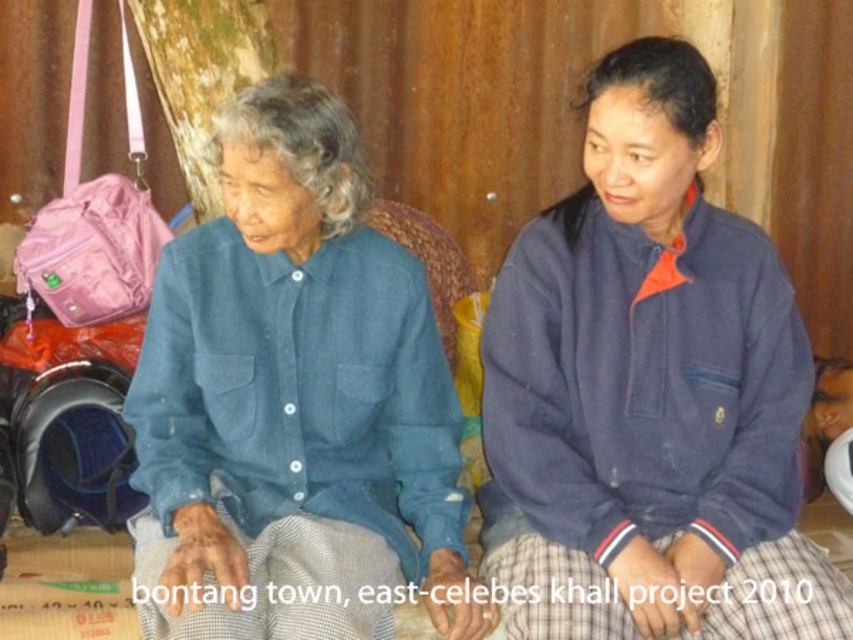
Between navy blue fleece at center and blue denim shirt at center, which one appears on the right side from the viewer's perspective?

navy blue fleece at center is more to the right.

Find the location of a particular element. The width and height of the screenshot is (853, 640). navy blue fleece at center is located at coordinates (648, 392).